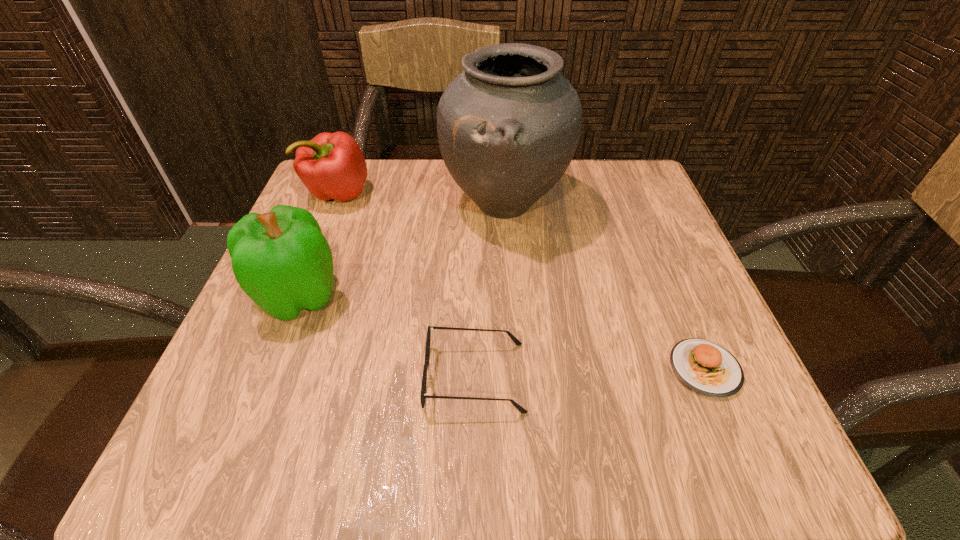
This screenshot has height=540, width=960. In order to click on free space at the far left corner of the desktop in this screenshot , I will do `click(327, 206)`.

In the image, there is a desktop. What are the coordinates of `free region at the far right corner` in the screenshot? It's located at (623, 191).

Locate an element on the screen. vacant area at the near right corner of the desktop is located at coordinates tap(684, 463).

Where is `vacant point located between the urn and the fourth tallest object`? This screenshot has height=540, width=960. vacant point located between the urn and the fourth tallest object is located at coordinates (490, 291).

Identify the location of free space between the taller bell pepper and the urn. The height and width of the screenshot is (540, 960). (402, 250).

Locate an element on the screen. The image size is (960, 540). free space between the rightmost object and the nearer bell pepper is located at coordinates (502, 333).

This screenshot has width=960, height=540. In order to click on free space between the rightmost object and the fourth tallest object in this screenshot , I will do `click(590, 373)`.

In order to click on free area in between the urn and the third tallest object in this screenshot , I will do `click(421, 199)`.

Where is `vacant point located between the rightmost object and the shorter bell pepper`? vacant point located between the rightmost object and the shorter bell pepper is located at coordinates (521, 281).

Where is `free space between the farther bell pepper and the second shortest object`? free space between the farther bell pepper and the second shortest object is located at coordinates (406, 286).